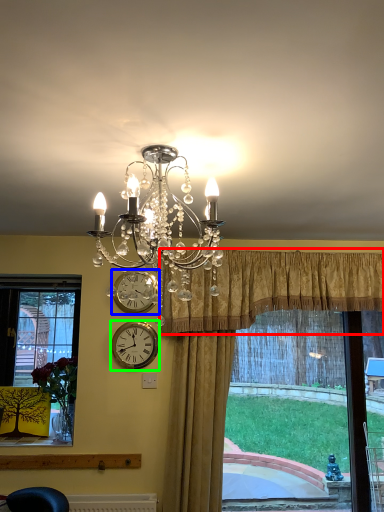
Question: Based on their relative distances, which object is nearer to curtain (highlighted by a red box)? Choose from clock (highlighted by a blue box) and wall clock (highlighted by a green box).

Choices:
 (A) clock
 (B) wall clock

Answer: (A)